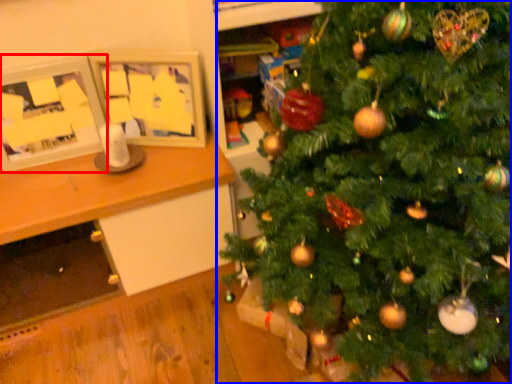
Question: Which point is further to the camera, picture frame (highlighted by a red box) or christmas tree (highlighted by a blue box)?

Choices:
 (A) picture frame
 (B) christmas tree

Answer: (A)